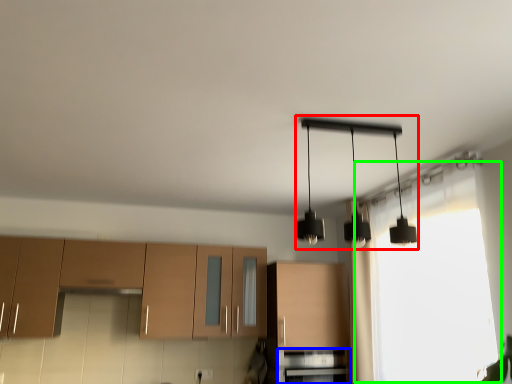
Question: Based on their relative distances, which object is nearer to lamp (highlighted by a red box)? Choose from oven (highlighted by a blue box) and window (highlighted by a green box).

Choices:
 (A) oven
 (B) window

Answer: (B)